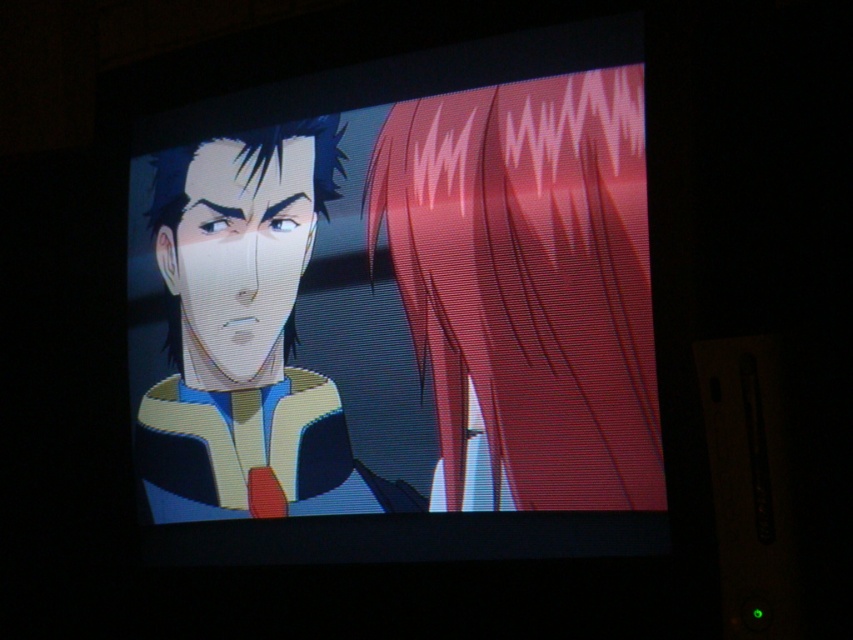
You are an interior designer who needs to place a 1.5 inch wide decorative item between the matte black monitor at center and the matte yellow jacket at left. Can you fit it there?

The matte black monitor at center is 1.75 inches from the matte yellow jacket at left. Since the decorative item is 1.5 inches wide, it can fit between them with a small gap remaining.